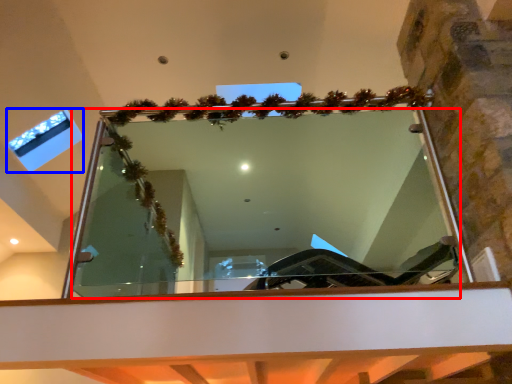
Question: Which of the following is the closest to the observer, mirror (highlighted by a red box) or window (highlighted by a blue box)?

Choices:
 (A) mirror
 (B) window

Answer: (A)